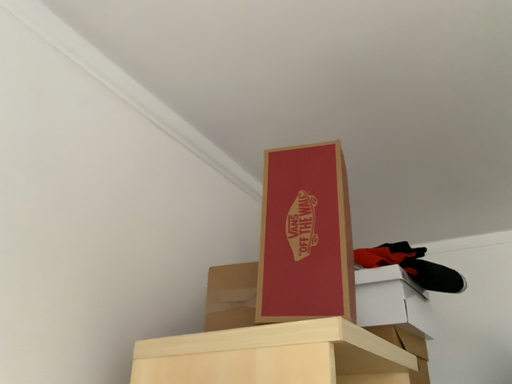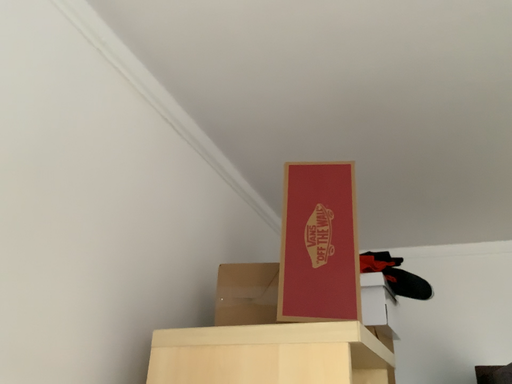
Question: Which way did the camera rotate in the video?

Choices:
 (A) rotated left
 (B) rotated right

Answer: (B)